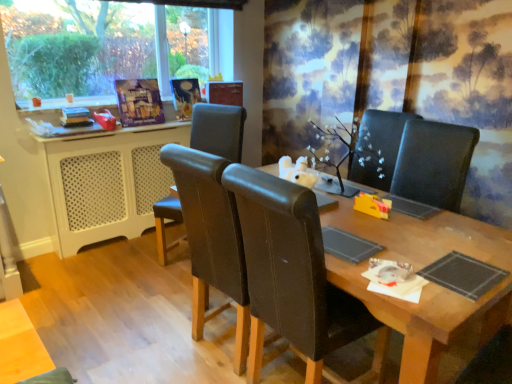
Describe the element at coordinates (294, 276) in the screenshot. This screenshot has width=512, height=384. I see `brown leather chair at center, the 2th chair from the back` at that location.

This screenshot has height=384, width=512. What are the coordinates of `white perforated plastic at left` in the screenshot? It's located at (x=106, y=182).

What is the approximate height of wooden table at center?

wooden table at center is 78.05 centimeters tall.

This screenshot has height=384, width=512. In order to click on leather at center, arranged as the 2th chair when viewed from the right in this screenshot , I will do [218, 130].

Can you confirm if leather at center, placed as the first chair when sorted from left to right, is thinner than wooden table at center?

Indeed, leather at center, placed as the first chair when sorted from left to right, has a lesser width compared to wooden table at center.

Is leather at center, which is counted as the 2th chair, starting from the front, far away from wooden table at center?

Yes, leather at center, which is counted as the 2th chair, starting from the front, and wooden table at center are located far from each other.

Measure the distance between leather at center, which appears as the 1th chair when viewed from the back, and wooden table at center.

leather at center, which appears as the 1th chair when viewed from the back, is 1.57 meters away from wooden table at center.

Consider the image. Which object is positioned more to the left, leather at center, which appears as the 1th chair when viewed from the back, or wooden table at center?

leather at center, which appears as the 1th chair when viewed from the back.

Consider the image. From a real-world perspective, who is located lower, wooden table at center or brown leather chair at center, the 2th chair from the back?

From a 3D spatial view, wooden table at center is below.

How different are the orientations of wooden table at center and brown leather chair at center, positioned as the 1th chair in right-to-left order, in degrees?

180 degrees separate the facing orientations of wooden table at center and brown leather chair at center, positioned as the 1th chair in right-to-left order.

Can you confirm if wooden table at center is thinner than brown leather chair at center, positioned as the first chair in front-to-back order?

Incorrect, the width of wooden table at center is not less than that of brown leather chair at center, positioned as the first chair in front-to-back order.

Can you confirm if wooden table at center is positioned to the right of brown leather chair at center, positioned as the 1th chair in right-to-left order?

Indeed, wooden table at center is positioned on the right side of brown leather chair at center, positioned as the 1th chair in right-to-left order.

Can brown leather chair at center, which appears as the 2th chair when viewed from the left, be found inside leather at center, which is counted as the 2th chair, starting from the front?

No.

From the picture: From the image's perspective, which is below, leather at center, which is counted as the 2th chair, starting from the front, or brown leather chair at center, positioned as the first chair in front-to-back order?

brown leather chair at center, positioned as the first chair in front-to-back order.

Between leather at center, which appears as the 1th chair when viewed from the back, and brown leather chair at center, positioned as the first chair in front-to-back order, which one has larger width?

brown leather chair at center, positioned as the first chair in front-to-back order, is wider.

Is leather at center, which is counted as the 2th chair, starting from the front, aimed at brown leather chair at center, positioned as the 1th chair in right-to-left order?

No.

From the image's perspective, who appears lower, leather at center, placed as the first chair when sorted from left to right, or white perforated plastic at left?

leather at center, placed as the first chair when sorted from left to right, from the image's perspective.

In the scene shown: Is leather at center, placed as the first chair when sorted from left to right, to the left of white perforated plastic at left from the viewer's perspective?

No.

Which is behind, point (193, 138) or point (48, 147)?

The point (193, 138) is farther from the camera.

How many degrees apart are the facing directions of leather at center, which appears as the 1th chair when viewed from the back, and white perforated plastic at left?

The facing directions of leather at center, which appears as the 1th chair when viewed from the back, and white perforated plastic at left are 64.4 degrees apart.

Based on the photo, which of these two, brown leather chair at center, which appears as the 2th chair when viewed from the left, or leather at center, which appears as the 1th chair when viewed from the back, is smaller?

Smaller between the two is leather at center, which appears as the 1th chair when viewed from the back.

Considering the relative sizes of brown leather chair at center, positioned as the first chair in front-to-back order, and leather at center, which is counted as the 2th chair, starting from the front, in the image provided, is brown leather chair at center, positioned as the first chair in front-to-back order, shorter than leather at center, which is counted as the 2th chair, starting from the front,?

In fact, brown leather chair at center, positioned as the first chair in front-to-back order, may be taller than leather at center, which is counted as the 2th chair, starting from the front.

Considering the relative sizes of brown leather chair at center, positioned as the 1th chair in right-to-left order, and leather at center, placed as the first chair when sorted from left to right, in the image provided, is brown leather chair at center, positioned as the 1th chair in right-to-left order, thinner than leather at center, placed as the first chair when sorted from left to right,?

In fact, brown leather chair at center, positioned as the 1th chair in right-to-left order, might be wider than leather at center, placed as the first chair when sorted from left to right.

Is leather at center, which appears as the 1th chair when viewed from the back, surrounded by brown leather chair at center, positioned as the first chair in front-to-back order?

No, leather at center, which appears as the 1th chair when viewed from the back, is not a part of brown leather chair at center, positioned as the first chair in front-to-back order.

Between brown leather chair at center, the 2th chair from the back, and wooden table at center, which one has larger width?

wooden table at center is wider.

Which is closer to the camera, (255, 207) or (270, 165)?

Point (255, 207).

The image size is (512, 384). In order to click on table on the right of brown leather chair at center, positioned as the first chair in front-to-back order in this screenshot , I will do `click(428, 287)`.

Would you say white perforated plastic at left is inside or outside brown leather chair at center, positioned as the first chair in front-to-back order?

white perforated plastic at left is not enclosed by brown leather chair at center, positioned as the first chair in front-to-back order.

Can you see white perforated plastic at left touching brown leather chair at center, positioned as the 1th chair in right-to-left order?

white perforated plastic at left is not next to brown leather chair at center, positioned as the 1th chair in right-to-left order, and they're not touching.

Identify the location of the 2nd chair counting from the right of the white perforated plastic at left. The height and width of the screenshot is (384, 512). (294, 276).

In terms of height, does white perforated plastic at left look taller or shorter compared to brown leather chair at center, positioned as the 1th chair in right-to-left order?

white perforated plastic at left is shorter than brown leather chair at center, positioned as the 1th chair in right-to-left order.

There is a wooden table at center. Where is `the 2nd chair above it (from a real-world perspective)`? the 2nd chair above it (from a real-world perspective) is located at coordinates (218, 130).

In the image, there is a brown leather chair at center, positioned as the 1th chair in right-to-left order. At what (x,y) coordinates should I click in order to perform the action: click on table below it (from the image's perspective). Please return your answer as a coordinate pair (x, y). The width and height of the screenshot is (512, 384). Looking at the image, I should click on (428, 287).

Considering their positions, is leather at center, placed as the first chair when sorted from left to right, positioned closer to white perforated plastic at left than wooden table at center?

leather at center, placed as the first chair when sorted from left to right.

From the image, which object appears to be farther from white perforated plastic at left, brown leather chair at center, which appears as the 2th chair when viewed from the left, or wooden table at center?

Among the two, wooden table at center is located further to white perforated plastic at left.

Estimate the real-world distances between objects in this image. Which object is further from white perforated plastic at left, wooden table at center or leather at center, placed as the first chair when sorted from left to right?

The object further to white perforated plastic at left is wooden table at center.

From the image, which object appears to be farther from brown leather chair at center, which appears as the 2th chair when viewed from the left, wooden table at center or white perforated plastic at left?

white perforated plastic at left.

From the image, which object appears to be farther from white perforated plastic at left, leather at center, placed as the first chair when sorted from left to right, or brown leather chair at center, which appears as the 2th chair when viewed from the left?

brown leather chair at center, which appears as the 2th chair when viewed from the left, lies further to white perforated plastic at left than the other object.

Considering their positions, is wooden table at center positioned closer to brown leather chair at center, the 2th chair from the back, than leather at center, which appears as the 1th chair when viewed from the back?

wooden table at center is closer to brown leather chair at center, the 2th chair from the back.

Considering their positions, is leather at center, which appears as the 1th chair when viewed from the back, positioned further to wooden table at center than white perforated plastic at left?

white perforated plastic at left is positioned further to the anchor wooden table at center.

When comparing their distances from wooden table at center, does brown leather chair at center, positioned as the first chair in front-to-back order, or white perforated plastic at left seem further?

The object further to wooden table at center is white perforated plastic at left.

This screenshot has width=512, height=384. I want to click on chair located between brown leather chair at center, the 2th chair from the back, and white perforated plastic at left in the depth direction, so click(x=218, y=130).

Locate an element on the screen. This screenshot has height=384, width=512. chair located between wooden table at center and leather at center, arranged as the 2th chair when viewed from the right, in the depth direction is located at coordinates (294, 276).